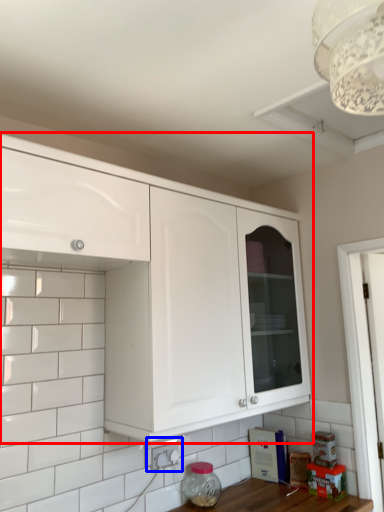
Question: Among these objects, which one is farthest to the camera, cabinetry (highlighted by a red box) or electric outlet (highlighted by a blue box)?

Choices:
 (A) cabinetry
 (B) electric outlet

Answer: (B)